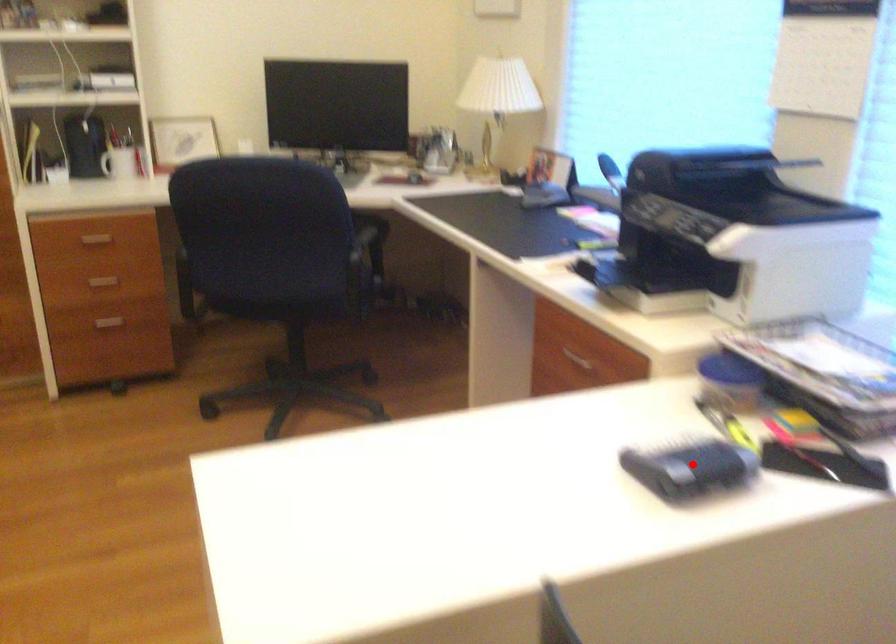
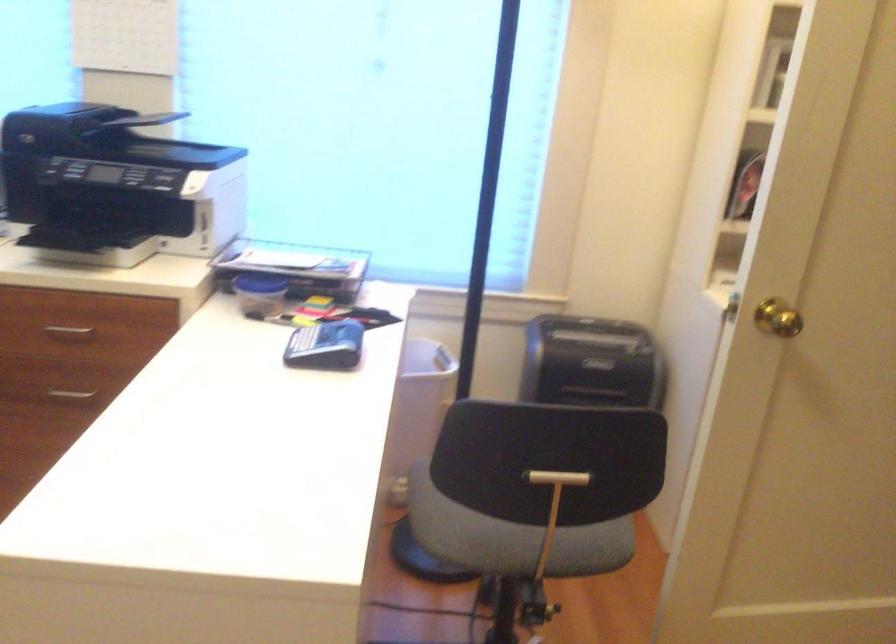
In the second image, find the point that corresponds to the highlighted location in the first image.

(325, 346)